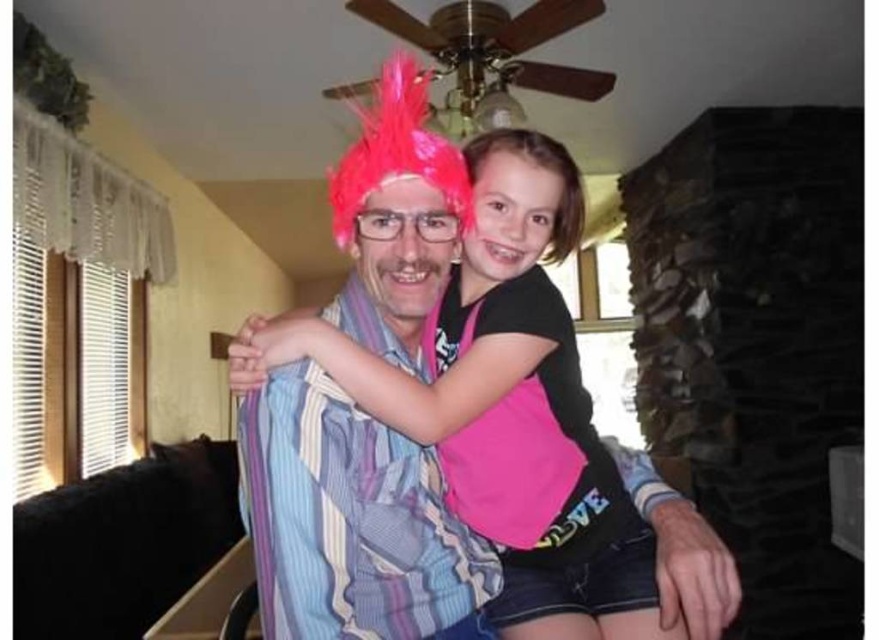
Question: Is pink fabric at center to the left of pink feathered wig at upper center from the viewer's perspective?

Choices:
 (A) yes
 (B) no

Answer: (A)

Question: Can you confirm if pink fabric at center is positioned below pink feathered wig at upper center?

Choices:
 (A) yes
 (B) no

Answer: (A)

Question: Is pink fabric at center thinner than pink feathered wig at upper center?

Choices:
 (A) yes
 (B) no

Answer: (B)

Question: Which object is farther from the camera taking this photo?

Choices:
 (A) pink feathered wig at upper center
 (B) pink fabric at center

Answer: (A)

Question: Among these objects, which one is nearest to the camera?

Choices:
 (A) pink feathered wig at upper center
 (B) pink fabric at center

Answer: (B)